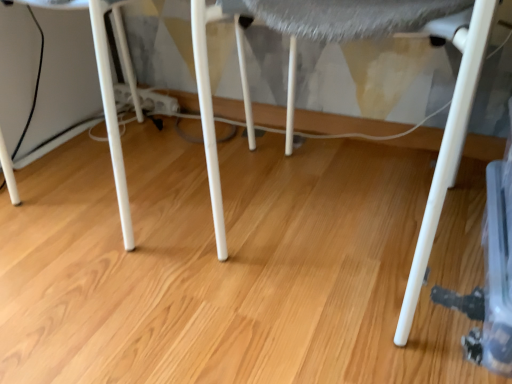
Find the location of a particular element. white glossy table at center is located at coordinates (104, 102).

What do you see at coordinates (104, 102) in the screenshot?
I see `white glossy table at center` at bounding box center [104, 102].

Image resolution: width=512 pixels, height=384 pixels. What are the coordinates of `white glossy table at center` in the screenshot? It's located at (104, 102).